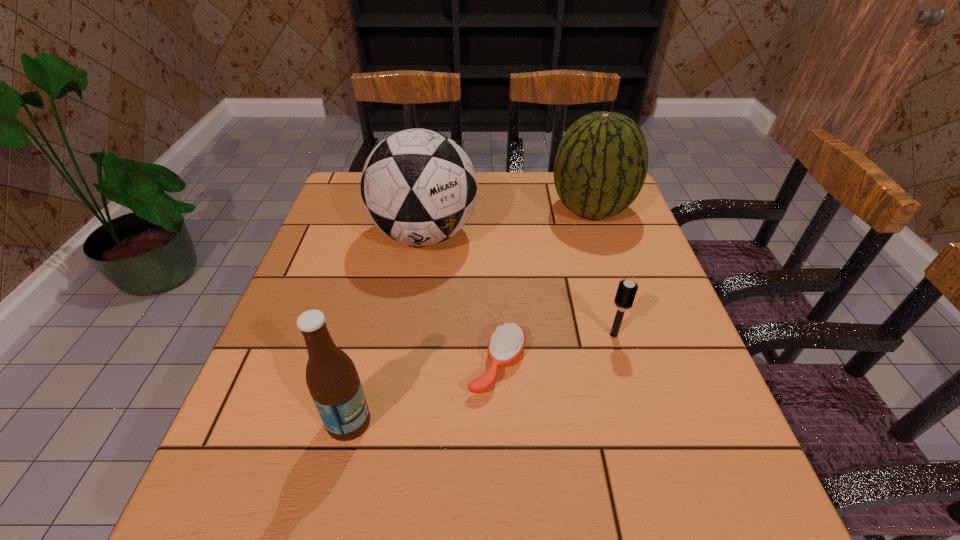
Where is `soccer ball`? This screenshot has height=540, width=960. soccer ball is located at coordinates (419, 187).

Image resolution: width=960 pixels, height=540 pixels. I want to click on watermelon, so click(x=601, y=164).

Image resolution: width=960 pixels, height=540 pixels. Identify the location of beer bottle. (332, 379).

At what (x,y) coordinates should I click in order to perform the action: click on the taller hairbrush. Please return your answer as a coordinate pair (x, y). The image size is (960, 540). Looking at the image, I should click on (626, 292).

You are a GUI agent. You are given a task and a screenshot of the screen. Output one action in this format:
    pyautogui.click(x=<x>, y=<y>)
    Task: Click on the fourth tallest object
    
    Given the screenshot: What is the action you would take?
    pyautogui.click(x=626, y=292)

Find the location of `the shorter hairbrush`. the shorter hairbrush is located at coordinates [x=506, y=344].

Identify the location of the left hairbrush. (506, 344).

Locate an element on the screen. The image size is (960, 540). vacant space situated 0.140m on the surface of the soccer ball where the brand logo is visible is located at coordinates (413, 313).

This screenshot has height=540, width=960. What are the coordinates of `free location located on the front of the watermelon` in the screenshot? It's located at (632, 336).

Locate an element on the screen. The height and width of the screenshot is (540, 960). free location located 0.330m on the right of the nearest object is located at coordinates (559, 422).